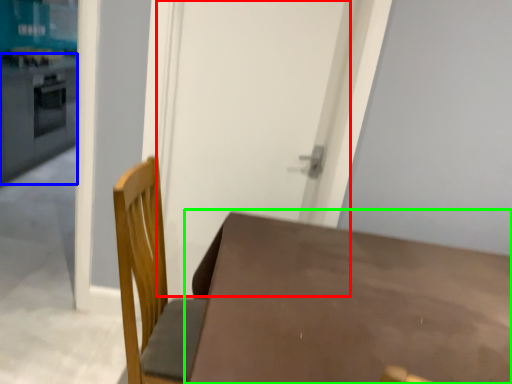
Question: Which object is positioned closest to screen door (highlighted by a red box)? Select from counter top (highlighted by a blue box) and table (highlighted by a green box).

Choices:
 (A) counter top
 (B) table

Answer: (B)